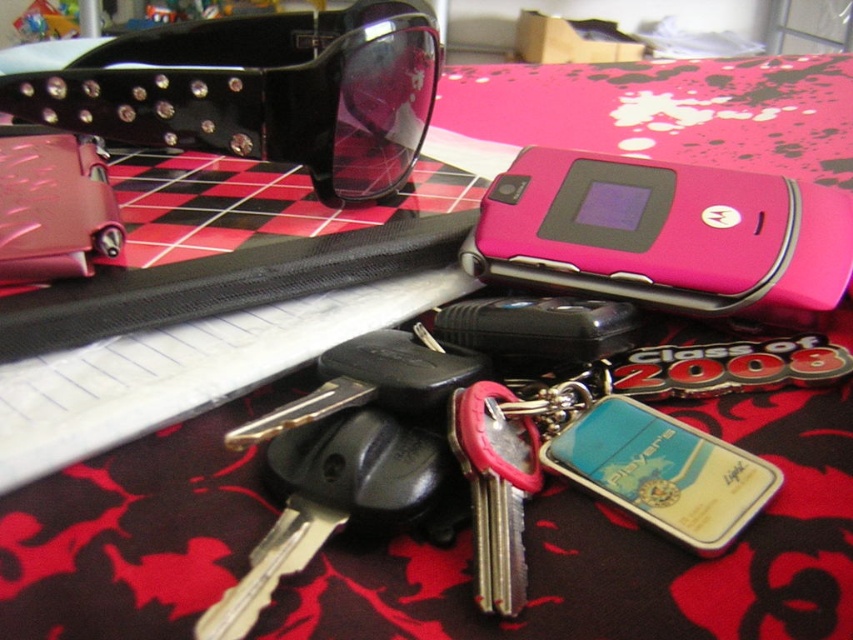
Measure the distance between black shiny sunglasses at upper left and pink plastic motorola phone at center.

A distance of 7.27 inches exists between black shiny sunglasses at upper left and pink plastic motorola phone at center.

This screenshot has height=640, width=853. Identify the location of black shiny sunglasses at upper left. (260, 92).

In order to click on black shiny sunglasses at upper left in this screenshot , I will do `click(260, 92)`.

The height and width of the screenshot is (640, 853). In order to click on black shiny sunglasses at upper left in this screenshot , I will do `click(260, 92)`.

Which is behind, point (700, 300) or point (489, 388)?

The point (700, 300) is behind.

Between pink plastic motorola phone at center and metallic silver key at center, which one has more height?

pink plastic motorola phone at center is taller.

At what (x,y) coordinates should I click in order to perform the action: click on pink plastic motorola phone at center. Please return your answer as a coordinate pair (x, y). Looking at the image, I should click on (663, 234).

The height and width of the screenshot is (640, 853). I want to click on pink plastic motorola phone at center, so click(663, 234).

Which of these two, black shiny sunglasses at upper left or metallic silver key at center, stands shorter?

Standing shorter between the two is metallic silver key at center.

The height and width of the screenshot is (640, 853). Describe the element at coordinates (260, 92) in the screenshot. I see `black shiny sunglasses at upper left` at that location.

At what (x,y) coordinates should I click in order to perform the action: click on black shiny sunglasses at upper left. Please return your answer as a coordinate pair (x, y). Looking at the image, I should click on (260, 92).